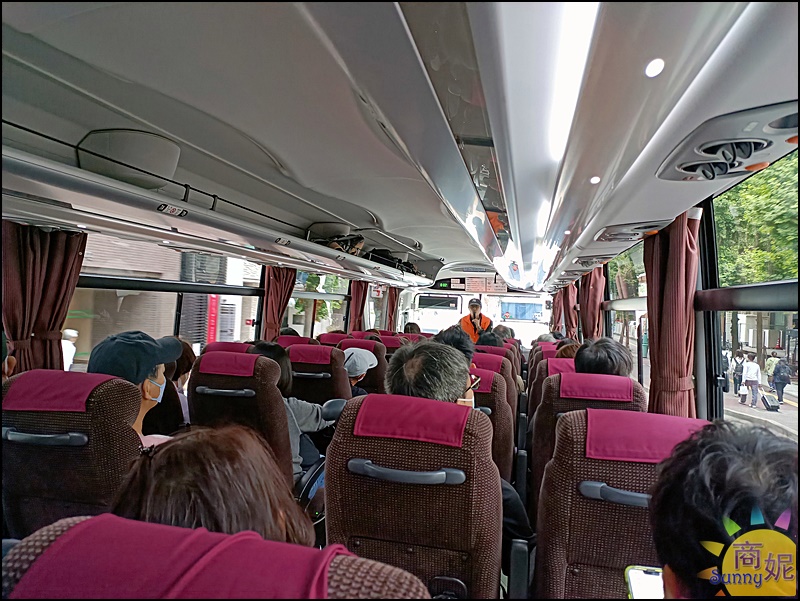
This screenshot has width=800, height=601. What are the coordinates of `window` in the screenshot? It's located at (770, 249), (626, 266), (620, 328), (529, 310), (313, 282), (318, 310), (97, 255), (98, 317), (757, 353).